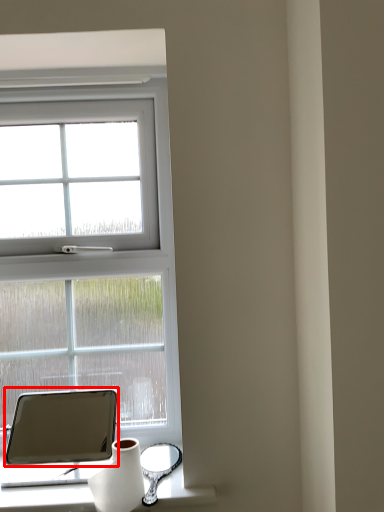
Question: From the image's perspective, what is the correct spatial positioning of tablet computer (annotated by the red box) in reference to vase?

Choices:
 (A) above
 (B) below

Answer: (A)